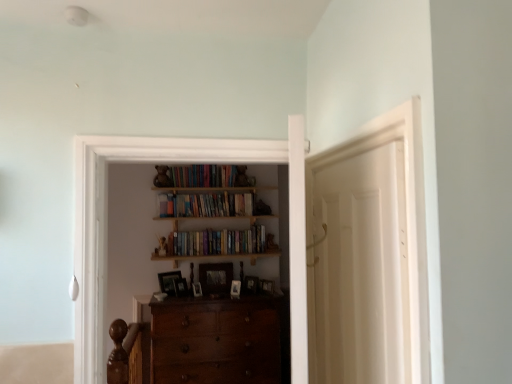
Locate an element on the screen. Image resolution: width=512 pixels, height=384 pixels. vacant region above hardcover books at center, which is counted as the second book, starting from the top (from a real-world perspective) is located at coordinates (216, 230).